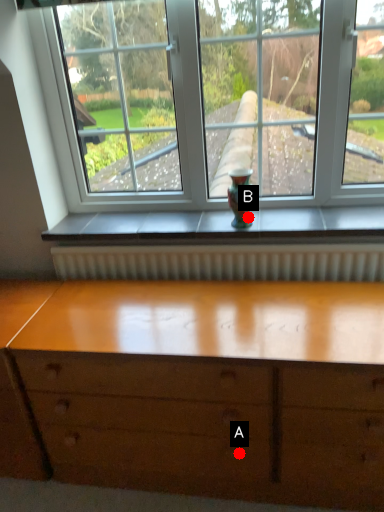
Question: Two points are circled on the image, labeled by A and B beside each circle. Which point is closer to the camera taking this photo?

Choices:
 (A) A is closer
 (B) B is closer

Answer: (A)